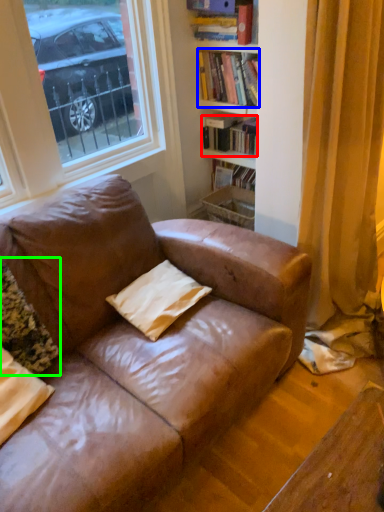
Question: Considering the real-world distances, which object is farthest from book (highlighted by a red box)? book (highlighted by a blue box) or pillow (highlighted by a green box)?

Choices:
 (A) book
 (B) pillow

Answer: (B)